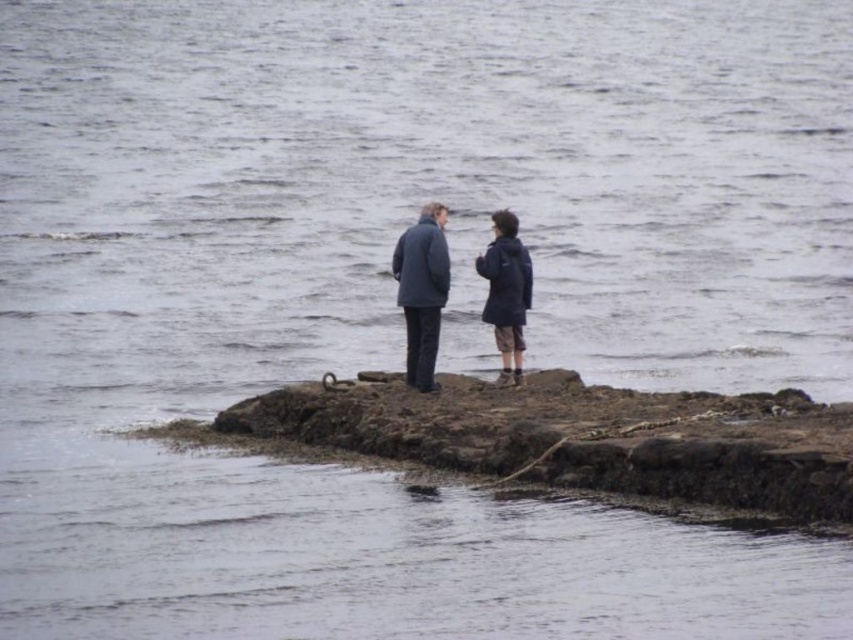
Is matte blue jacket at center above dark blue jacket at center?

No.

Is matte blue jacket at center to the right of dark blue jacket at center from the viewer's perspective?

Indeed, matte blue jacket at center is positioned on the right side of dark blue jacket at center.

Where is `matte blue jacket at center`? The image size is (853, 640). matte blue jacket at center is located at coordinates (422, 291).

You are a GUI agent. You are given a task and a screenshot of the screen. Output one action in this format:
    pyautogui.click(x=<x>, y=<y>)
    Task: Click on the matte blue jacket at center
    The width and height of the screenshot is (853, 640).
    Given the screenshot: What is the action you would take?
    pyautogui.click(x=422, y=291)

Is matte blue jacket at center further to the viewer compared to dark gray wool coat at center?

Yes.

How distant is matte blue jacket at center from dark gray wool coat at center?

matte blue jacket at center is 7.11 feet from dark gray wool coat at center.

Is point (500, 246) positioned before point (428, 385)?

No, (500, 246) is further to viewer.

The height and width of the screenshot is (640, 853). Find the location of `matte blue jacket at center`. matte blue jacket at center is located at coordinates (422, 291).

Does dark gray wool coat at center have a greater height compared to dark blue jacket at center?

Yes, dark gray wool coat at center is taller than dark blue jacket at center.

Is dark gray wool coat at center above dark blue jacket at center?

Answer: Indeed, dark gray wool coat at center is positioned over dark blue jacket at center.

Locate an element on the screen. dark gray wool coat at center is located at coordinates (422, 291).

What are the coordinates of `dark gray wool coat at center` in the screenshot? It's located at (422, 291).